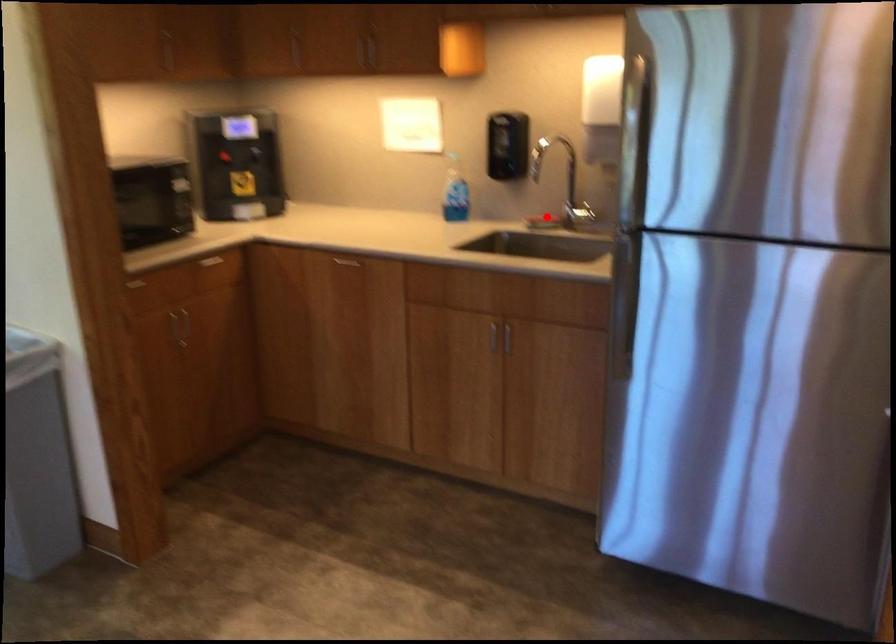
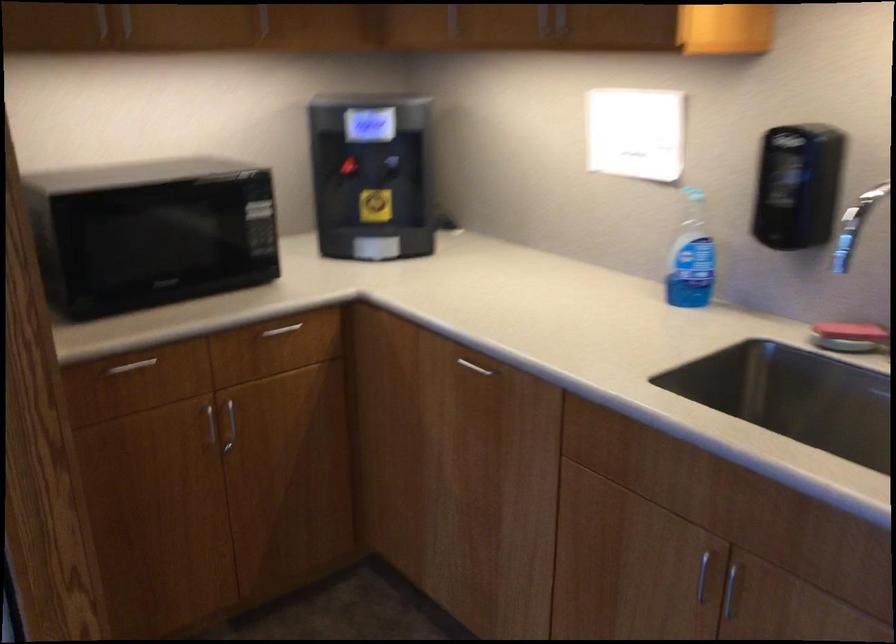
Question: I am providing you with two images of the same scene from different viewpoints. Image1 has a red point marked. In image2, the corresponding 3D location appears at what relative position? Reply with the corresponding letter.

Choices:
 (A) Closer
 (B) Farther

Answer: (A)